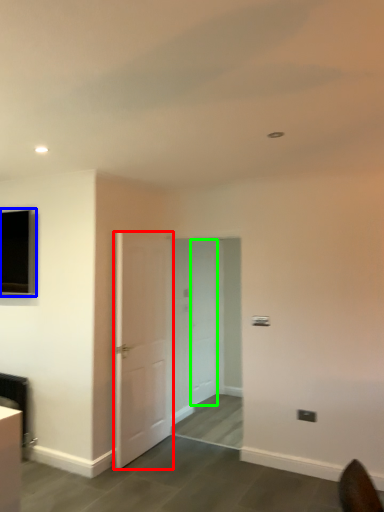
Question: Considering the real-world distances, which object is closest to door (highlighted by a red box)? window (highlighted by a blue box) or door (highlighted by a green box).

Choices:
 (A) window
 (B) door

Answer: (A)